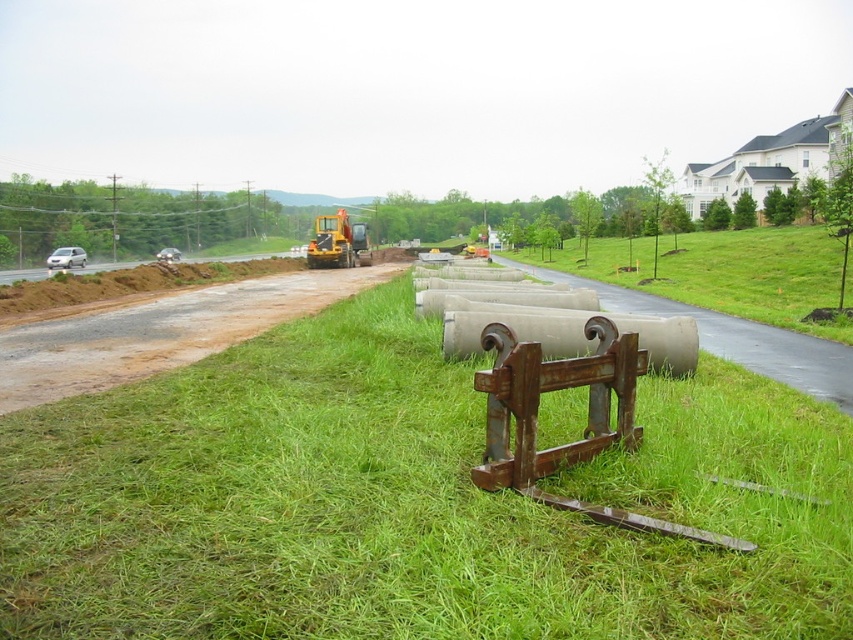
Does brown dirt track at left appear on the left side of yellow rubber excavator at center?

No, brown dirt track at left is not to the left of yellow rubber excavator at center.

Between brown dirt track at left and yellow rubber excavator at center, which one is positioned lower?

brown dirt track at left is below.

Is point (7, 346) more distant than point (340, 262)?

No.

At what (x,y) coordinates should I click in order to perform the action: click on brown dirt track at left. Please return your answer as a coordinate pair (x, y). Looking at the image, I should click on (160, 332).

Based on the photo, between green grass at center and brown dirt track at left, which one is positioned higher?

brown dirt track at left

Is green grass at center below brown dirt track at left?

Indeed, green grass at center is positioned under brown dirt track at left.

Image resolution: width=853 pixels, height=640 pixels. I want to click on green grass at center, so pyautogui.click(x=408, y=502).

Is green grass at center above yellow rubber excavator at center?

No.

Between point (366, 310) and point (328, 221), which one is positioned in front?

Point (366, 310)

The width and height of the screenshot is (853, 640). I want to click on green grass at center, so click(408, 502).